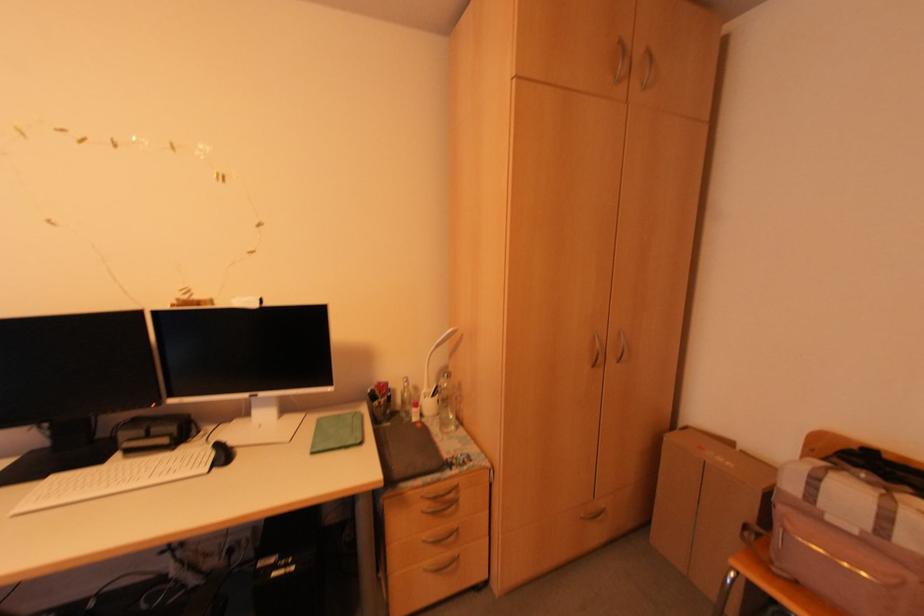
Find where to lift the cardboard box. Please return your answer as a coordinate pair (x, y).

(707, 506)